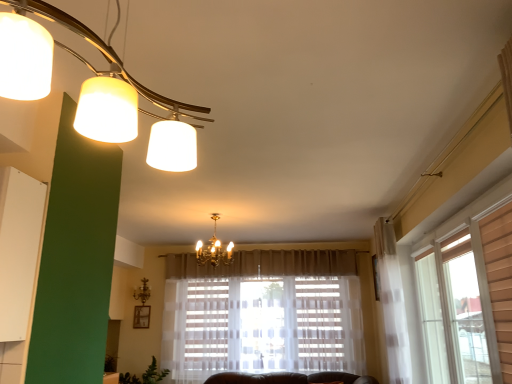
In order to face gold metallic chandelier at center, acting as the 2th lamp starting from the top, should I rotate leftwards or rightwards?

To align with it, rotate left about 5.426°.

Image resolution: width=512 pixels, height=384 pixels. I want to click on gold metallic chandelier at center, which is counted as the 3th lamp, starting from the right, so click(x=142, y=291).

The image size is (512, 384). What do you see at coordinates (97, 90) in the screenshot?
I see `white matte lampshade at upper left, the third lamp positioned from the back` at bounding box center [97, 90].

Identify the location of white matte lampshade at upper left, placed as the third lamp when sorted from left to right. The width and height of the screenshot is (512, 384). (97, 90).

The image size is (512, 384). Find the location of `gold metallic chandelier at center, the 2th lamp positioned from the front`. gold metallic chandelier at center, the 2th lamp positioned from the front is located at coordinates (214, 249).

From a real-world perspective, is white matte lampshade at upper left, the 1th lamp positioned from the right, beneath gold metallic chandelier at center, the second lamp ordered from the bottom?

Yes, from a real-world perspective, white matte lampshade at upper left, the 1th lamp positioned from the right, is below gold metallic chandelier at center, the second lamp ordered from the bottom.

Is white matte lampshade at upper left, which ranks as the third lamp in bottom-to-top order, wider than gold metallic chandelier at center, placed as the 2th lamp when sorted from right to left?

Yes.

Considering the sizes of objects white matte lampshade at upper left, positioned as the 1th lamp in top-to-bottom order, and gold metallic chandelier at center, placed as the 2th lamp when sorted from right to left, in the image provided, who is bigger, white matte lampshade at upper left, positioned as the 1th lamp in top-to-bottom order, or gold metallic chandelier at center, placed as the 2th lamp when sorted from right to left,?

With larger size is white matte lampshade at upper left, positioned as the 1th lamp in top-to-bottom order.

Considering the positions of point (189, 162) and point (214, 216), is point (189, 162) closer or farther from the camera than point (214, 216)?

Point (189, 162).

Which is more to the left, gold metallic chandelier at center, the 2th lamp positioned from the front, or white matte lampshade at upper left, the third lamp positioned from the back?

gold metallic chandelier at center, the 2th lamp positioned from the front.

Which is in front, gold metallic chandelier at center, acting as the 2th lamp starting from the top, or white matte lampshade at upper left, the 1th lamp positioned from the right?

white matte lampshade at upper left, the 1th lamp positioned from the right, is in front.

Are gold metallic chandelier at center, placed as the 2th lamp when sorted from right to left, and white matte lampshade at upper left, placed as the third lamp when sorted from left to right, making contact?

No, gold metallic chandelier at center, placed as the 2th lamp when sorted from right to left, is not in contact with white matte lampshade at upper left, placed as the third lamp when sorted from left to right.

Looking at this image, which of these two, gold metallic chandelier at center, the second lamp ordered from the bottom, or gold metallic chandelier at center, the third lamp from the top, is smaller?

gold metallic chandelier at center, the third lamp from the top.

The width and height of the screenshot is (512, 384). I want to click on the 2nd lamp above the gold metallic chandelier at center, arranged as the first lamp when viewed from the left (from a real-world perspective), so click(x=214, y=249).

From a real-world perspective, between gold metallic chandelier at center, the second lamp ordered from the bottom, and gold metallic chandelier at center, the 1th lamp when ordered from back to front, who is vertically higher?

In real-world perspective, gold metallic chandelier at center, the second lamp ordered from the bottom, is above.

Is gold metallic chandelier at center, the 1th lamp when ordered from back to front, at the right side of white matte lampshade at upper left, placed as the third lamp when sorted from left to right?

No.

Is gold metallic chandelier at center, the 1th lamp when ordered from back to front, outside of white matte lampshade at upper left, which ranks as the third lamp in bottom-to-top order?

gold metallic chandelier at center, the 1th lamp when ordered from back to front, is positioned outside white matte lampshade at upper left, which ranks as the third lamp in bottom-to-top order.

Is gold metallic chandelier at center, the 1th lamp when ordered from back to front, behind white matte lampshade at upper left, which ranks as the third lamp in bottom-to-top order?

Yes, gold metallic chandelier at center, the 1th lamp when ordered from back to front, is further from the camera.

You are a GUI agent. You are given a task and a screenshot of the screen. Output one action in this format:
    pyautogui.click(x=<x>, y=<y>)
    Task: Click on the 1st lamp directly above the gold metallic chandelier at center, arranged as the 3th lamp when viewed from the front (from a real-world perspective)
    The image size is (512, 384).
    Given the screenshot: What is the action you would take?
    pyautogui.click(x=97, y=90)

From the picture: What's the angular difference between gold metallic chandelier at center, arranged as the 3th lamp when viewed from the front, and gold metallic chandelier at center, the 2th lamp positioned from the front,'s facing directions?

There is a 0.000317-degree angle between the facing directions of gold metallic chandelier at center, arranged as the 3th lamp when viewed from the front, and gold metallic chandelier at center, the 2th lamp positioned from the front.

Which object is positioned more to the left, gold metallic chandelier at center, the third lamp from the top, or gold metallic chandelier at center, acting as the 2th lamp starting from the top?

Positioned to the left is gold metallic chandelier at center, the third lamp from the top.

Which object is wider, gold metallic chandelier at center, arranged as the 3th lamp when viewed from the front, or gold metallic chandelier at center, placed as the 2th lamp when sorted from right to left?

Wider between the two is gold metallic chandelier at center, placed as the 2th lamp when sorted from right to left.

From the image's perspective, is gold metallic chandelier at center, which is the first lamp in bottom-to-top order, below gold metallic chandelier at center, the second lamp ordered from the bottom?

Yes, from the image's perspective, gold metallic chandelier at center, which is the first lamp in bottom-to-top order, is below gold metallic chandelier at center, the second lamp ordered from the bottom.

Considering the relative sizes of white matte lampshade at upper left, the third lamp positioned from the back, and gold metallic chandelier at center, the third lamp from the top, in the image provided, is white matte lampshade at upper left, the third lamp positioned from the back, thinner than gold metallic chandelier at center, the third lamp from the top,?

No, white matte lampshade at upper left, the third lamp positioned from the back, is not thinner than gold metallic chandelier at center, the third lamp from the top.

Is white matte lampshade at upper left, positioned as the 1th lamp in top-to-bottom order, turned away from gold metallic chandelier at center, which is the first lamp in bottom-to-top order?

That's not correct — white matte lampshade at upper left, positioned as the 1th lamp in top-to-bottom order, is not looking away from gold metallic chandelier at center, which is the first lamp in bottom-to-top order.

Can you confirm if white matte lampshade at upper left, positioned as the 1th lamp in top-to-bottom order, is positioned to the left of gold metallic chandelier at center, arranged as the first lamp when viewed from the left?

In fact, white matte lampshade at upper left, positioned as the 1th lamp in top-to-bottom order, is to the right of gold metallic chandelier at center, arranged as the first lamp when viewed from the left.

From a real-world perspective, does white matte lampshade at upper left, placed as the third lamp when sorted from left to right, stand above gold metallic chandelier at center, arranged as the first lamp when viewed from the left?

Yes, from a real-world perspective, white matte lampshade at upper left, placed as the third lamp when sorted from left to right, is on top of gold metallic chandelier at center, arranged as the first lamp when viewed from the left.

This screenshot has height=384, width=512. Identify the location of lamp that is the 1st object to the left of the white matte lampshade at upper left, which ranks as the third lamp in bottom-to-top order, starting at the anchor. (214, 249).

Locate an element on the screen. lamp in front of the gold metallic chandelier at center, the 2th lamp positioned from the front is located at coordinates (97, 90).

Estimate the real-world distances between objects in this image. Which object is closer to gold metallic chandelier at center, acting as the 2th lamp starting from the top, gold metallic chandelier at center, which is the first lamp in bottom-to-top order, or white matte lampshade at upper left, which ranks as the third lamp in bottom-to-top order?

The object closer to gold metallic chandelier at center, acting as the 2th lamp starting from the top, is gold metallic chandelier at center, which is the first lamp in bottom-to-top order.

Looking at the image, which one is located further to gold metallic chandelier at center, the second lamp when ordered from left to right, white matte lampshade at upper left, placed as the third lamp when sorted from left to right, or gold metallic chandelier at center, the third lamp from the top?

white matte lampshade at upper left, placed as the third lamp when sorted from left to right, is positioned further to the anchor gold metallic chandelier at center, the second lamp when ordered from left to right.

Based on their spatial positions, is gold metallic chandelier at center, the third lamp from the top, or gold metallic chandelier at center, the second lamp when ordered from left to right, further from white matte lampshade at upper left, which ranks as the third lamp in bottom-to-top order?

The object further to white matte lampshade at upper left, which ranks as the third lamp in bottom-to-top order, is gold metallic chandelier at center, the third lamp from the top.

From the image, which object appears to be nearer to white matte lampshade at upper left, the third lamp positioned from the back, gold metallic chandelier at center, the 2th lamp positioned from the front, or gold metallic chandelier at center, arranged as the first lamp when viewed from the left?

gold metallic chandelier at center, the 2th lamp positioned from the front, is closer to white matte lampshade at upper left, the third lamp positioned from the back.

Looking at the image, which one is located closer to gold metallic chandelier at center, the third lamp from the top, white matte lampshade at upper left, positioned as the 1th lamp in top-to-bottom order, or gold metallic chandelier at center, acting as the 2th lamp starting from the top?

Based on the image, gold metallic chandelier at center, acting as the 2th lamp starting from the top, appears to be nearer to gold metallic chandelier at center, the third lamp from the top.

When comparing their distances from gold metallic chandelier at center, the 1th lamp when ordered from back to front, does gold metallic chandelier at center, placed as the 2th lamp when sorted from right to left, or white matte lampshade at upper left, which ranks as the third lamp in bottom-to-top order, seem closer?

Among the two, gold metallic chandelier at center, placed as the 2th lamp when sorted from right to left, is located nearer to gold metallic chandelier at center, the 1th lamp when ordered from back to front.

Identify the location of lamp between white matte lampshade at upper left, positioned as the 1th lamp in top-to-bottom order, and gold metallic chandelier at center, arranged as the first lamp when viewed from the left, along the z-axis. The image size is (512, 384). (214, 249).